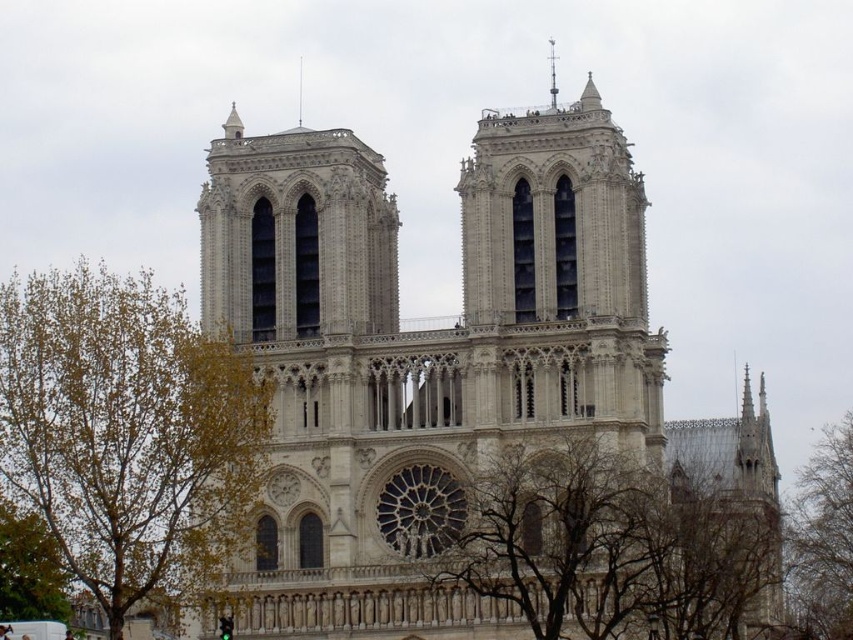
Question: Can you confirm if white stone church at center is positioned to the right of polished silver spire at upper center?

Choices:
 (A) yes
 (B) no

Answer: (B)

Question: Among these objects, which one is farthest from the camera?

Choices:
 (A) polished silver spire at upper center
 (B) smooth stone spire at upper center
 (C) green leafy tree at left
 (D) bare branches at lower center

Answer: (B)

Question: Which is farther from the green leafy tree at left?

Choices:
 (A) brown leafy tree at lower right
 (B) green leafy tree at lower left

Answer: (A)

Question: Is white stone church at center below bare branches at lower center?

Choices:
 (A) yes
 (B) no

Answer: (B)

Question: In this image, where is green leafy tree at left located relative to bare branches at lower center?

Choices:
 (A) below
 (B) above

Answer: (B)

Question: Among these objects, which one is farthest from the camera?

Choices:
 (A) white stone church at center
 (B) smooth stone spire at upper center
 (C) brown leafy tree at lower right

Answer: (B)